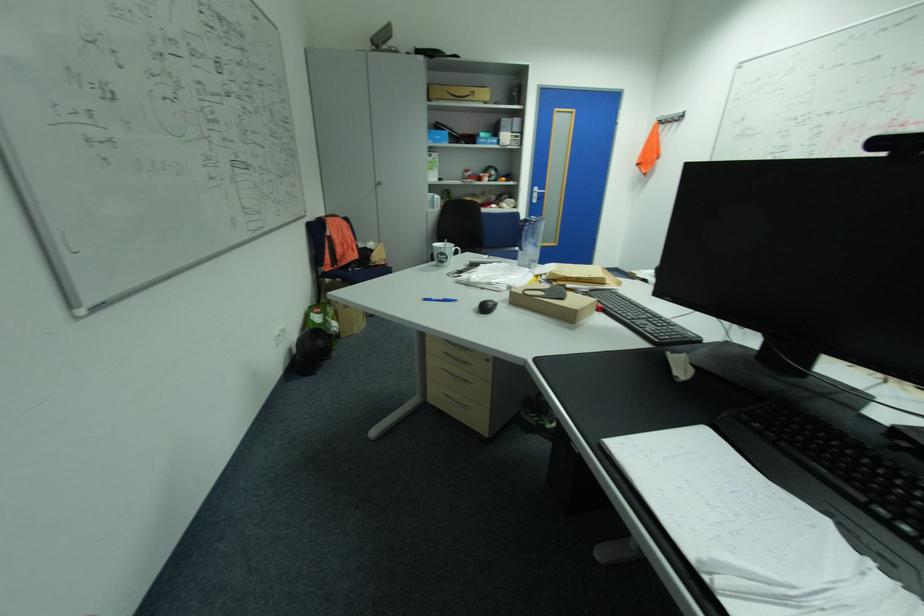
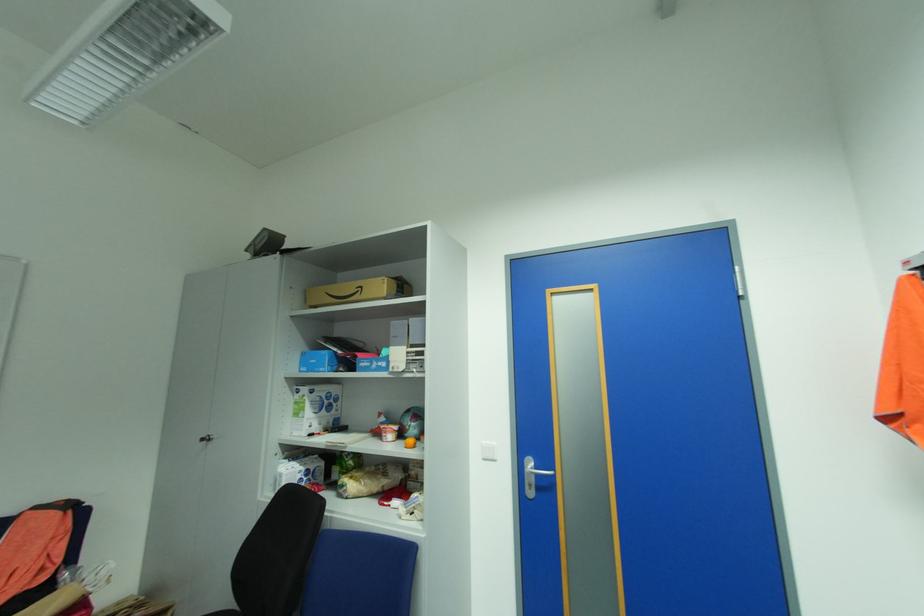
In the second image, find the point that corresponds to pixel 488 175 in the first image.

(388, 427)